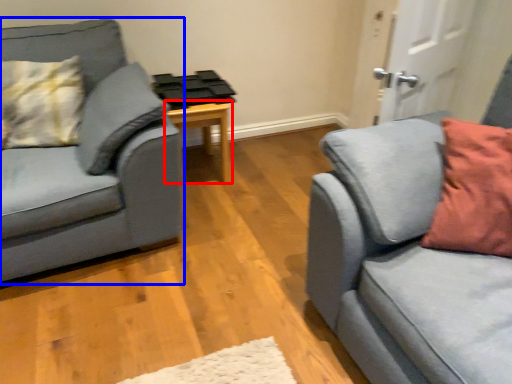
Question: Which of the following is the farthest to the observer, table (highlighted by a red box) or studio couch (highlighted by a blue box)?

Choices:
 (A) table
 (B) studio couch

Answer: (A)